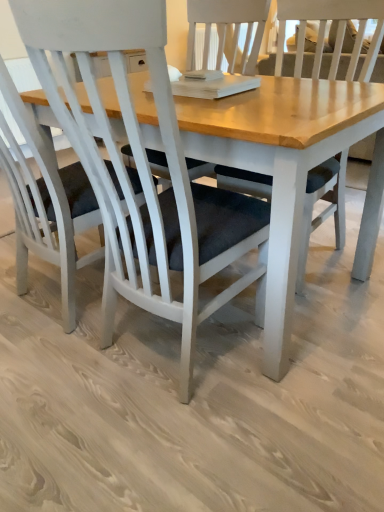
Where is `free space in front of white matte chair at center, marked as the 2th chair in a right-to-left arrangement`? This screenshot has height=512, width=384. free space in front of white matte chair at center, marked as the 2th chair in a right-to-left arrangement is located at coordinates (50, 389).